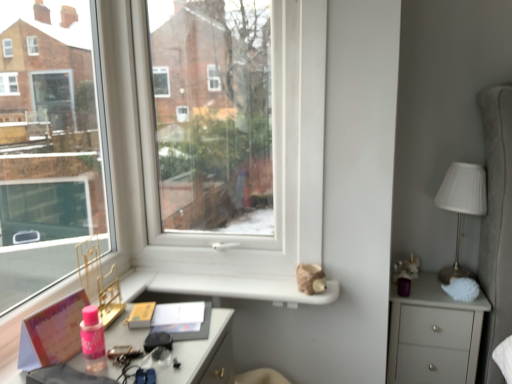
Question: From a real-world perspective, is matte gray chest of drawers at right positioned over transparent glass window at center based on gravity?

Choices:
 (A) no
 (B) yes

Answer: (A)

Question: Is matte gray chest of drawers at right next to transparent glass window at center?

Choices:
 (A) yes
 (B) no

Answer: (B)

Question: Is matte gray chest of drawers at right aimed at transparent glass window at center?

Choices:
 (A) yes
 (B) no

Answer: (B)

Question: Is the depth of matte gray chest of drawers at right greater than that of transparent glass window at center?

Choices:
 (A) no
 (B) yes

Answer: (B)

Question: Is matte gray chest of drawers at right not inside transparent glass window at center?

Choices:
 (A) no
 (B) yes

Answer: (B)

Question: From the image's perspective, is white ribbed fabric at right positioned above or below matte gray chest of drawers at right?

Choices:
 (A) above
 (B) below

Answer: (A)

Question: Is white ribbed fabric at right taller or shorter than matte gray chest of drawers at right?

Choices:
 (A) tall
 (B) short

Answer: (B)

Question: Considering the positions of white ribbed fabric at right and matte gray chest of drawers at right in the image, is white ribbed fabric at right wider or thinner than matte gray chest of drawers at right?

Choices:
 (A) wide
 (B) thin

Answer: (B)

Question: From a real-world perspective, is white ribbed fabric at right positioned above or below matte gray chest of drawers at right?

Choices:
 (A) above
 (B) below

Answer: (A)

Question: Considering the positions of pink matte book at lower left and matte gray chest of drawers at right in the image, is pink matte book at lower left taller or shorter than matte gray chest of drawers at right?

Choices:
 (A) tall
 (B) short

Answer: (B)

Question: From the image's perspective, relative to matte gray chest of drawers at right, is pink matte book at lower left above or below?

Choices:
 (A) above
 (B) below

Answer: (A)

Question: Would you say pink matte book at lower left is inside or outside matte gray chest of drawers at right?

Choices:
 (A) inside
 (B) outside

Answer: (B)

Question: Is point (79, 296) positioned closer to the camera than point (429, 326)?

Choices:
 (A) closer
 (B) farther

Answer: (A)

Question: Looking at their shapes, would you say matte gray chest of drawers at right is wider or thinner than pink matte book at lower left?

Choices:
 (A) wide
 (B) thin

Answer: (A)

Question: Which is correct: matte gray chest of drawers at right is inside pink matte book at lower left, or outside of it?

Choices:
 (A) outside
 (B) inside

Answer: (A)